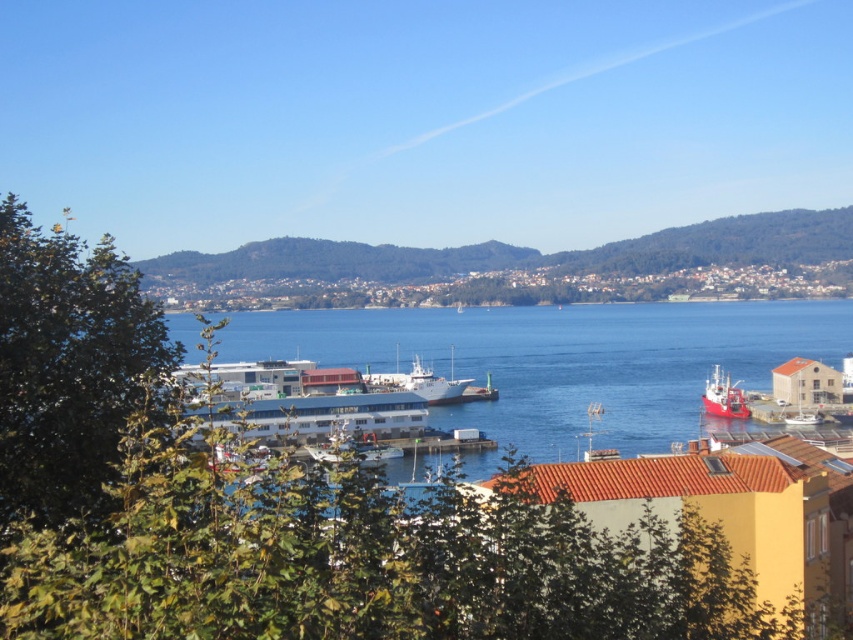
Question: Does blue water at center appear over white matte ship at center?

Choices:
 (A) yes
 (B) no

Answer: (A)

Question: Among these objects, which one is farthest from the camera?

Choices:
 (A) white matte cruise ship at center
 (B) white matte ship at center
 (C) red matte boat at right

Answer: (C)

Question: Estimate the real-world distances between objects in this image. Which object is farther from the white matte cruise ship at center?

Choices:
 (A) white matte ship at center
 (B) blue water at center

Answer: (B)

Question: Which object appears farthest from the camera in this image?

Choices:
 (A) red matte boat at right
 (B) white matte ship at center
 (C) white matte cruise ship at center
 (D) blue water at center

Answer: (A)

Question: Can you confirm if blue water at center is positioned to the left of white matte cruise ship at center?

Choices:
 (A) no
 (B) yes

Answer: (B)

Question: Can you confirm if blue water at center is positioned to the left of white matte cruise ship at center?

Choices:
 (A) yes
 (B) no

Answer: (A)